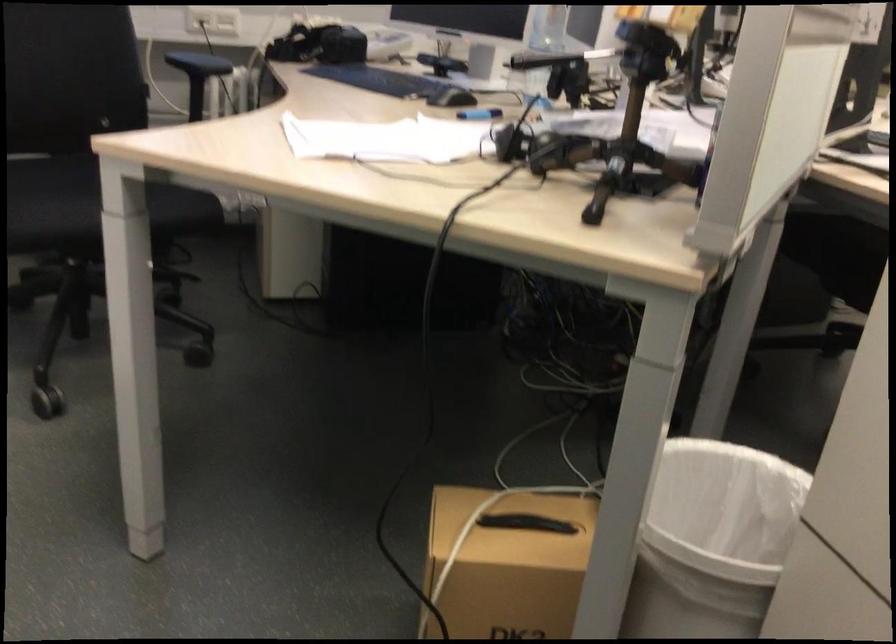
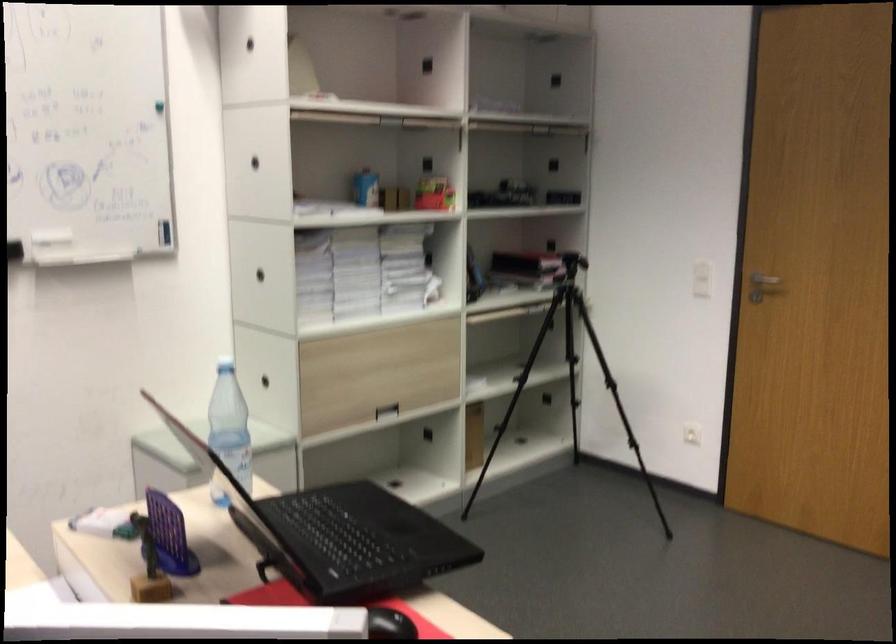
The images are taken continuously from a first-person perspective. In which direction is your viewpoint rotating?

The camera's rotation is toward right-down.